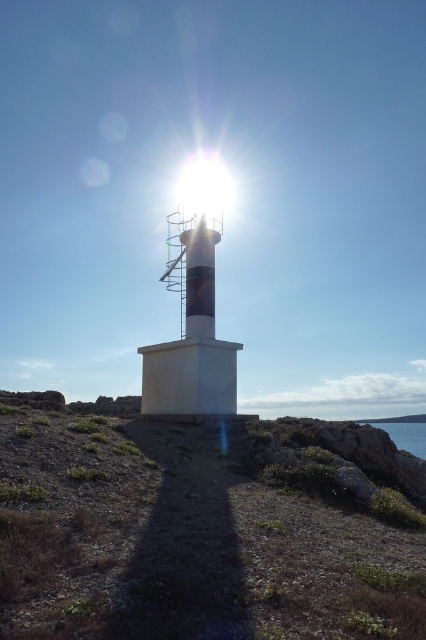
Does dull brown dirt at center appear on the right side of blue water at lower right?

No, dull brown dirt at center is not to the right of blue water at lower right.

Does dull brown dirt at center lie behind blue water at lower right?

No, dull brown dirt at center is in front of blue water at lower right.

Locate an element on the screen. Image resolution: width=426 pixels, height=640 pixels. dull brown dirt at center is located at coordinates (201, 529).

Where is `dull brown dirt at center`? The height and width of the screenshot is (640, 426). dull brown dirt at center is located at coordinates (201, 529).

Is dull brown dirt at center below bright white lens flare at upper center?

Yes, dull brown dirt at center is below bright white lens flare at upper center.

Can you confirm if dull brown dirt at center is positioned above bright white lens flare at upper center?

Incorrect, dull brown dirt at center is not positioned above bright white lens flare at upper center.

Which is behind, point (178, 529) or point (230, 196)?

The point (230, 196) is more distant.

The width and height of the screenshot is (426, 640). I want to click on dull brown dirt at center, so click(x=201, y=529).

Between bright white lens flare at upper center and blue water at lower right, which one appears on the left side from the viewer's perspective?

Positioned to the left is bright white lens flare at upper center.

From the picture: Can you confirm if bright white lens flare at upper center is positioned above blue water at lower right?

Indeed, bright white lens flare at upper center is positioned over blue water at lower right.

At what (x,y) coordinates should I click in order to perform the action: click on bright white lens flare at upper center. Please return your answer as a coordinate pair (x, y). Image resolution: width=426 pixels, height=640 pixels. Looking at the image, I should click on (204, 188).